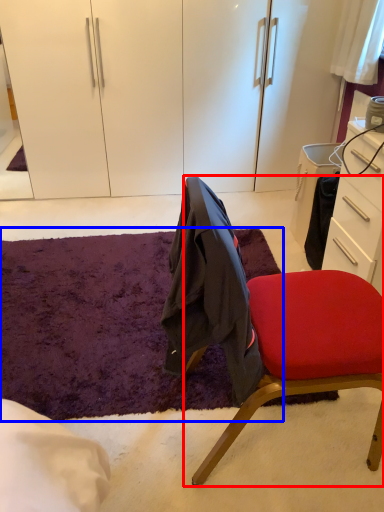
Question: Among these objects, which one is farthest to the camera, chair (highlighted by a red box) or mat (highlighted by a blue box)?

Choices:
 (A) chair
 (B) mat

Answer: (B)